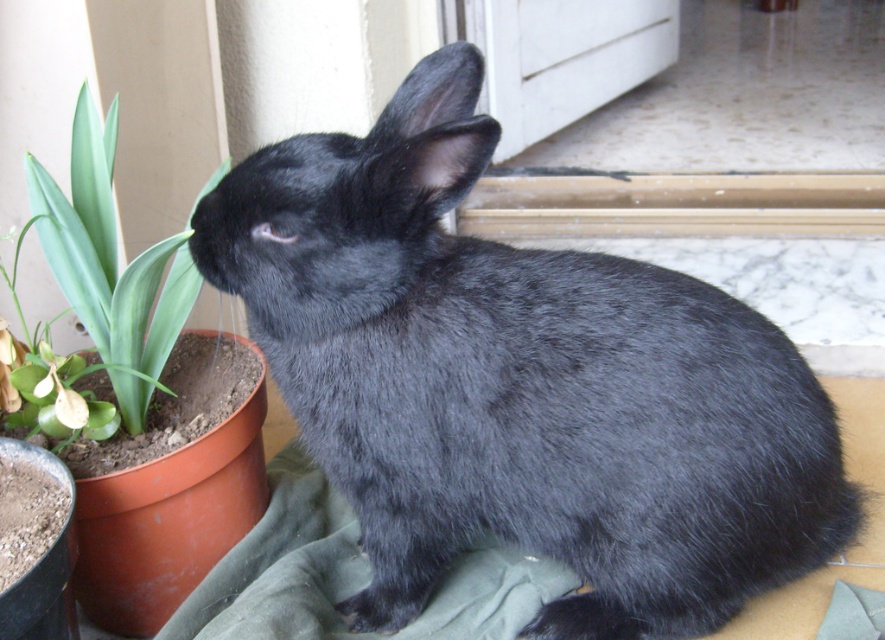
Can you confirm if green leafy plant at lower left is wider than white matte screen door at upper center?

No, green leafy plant at lower left is not wider than white matte screen door at upper center.

Can you confirm if green leafy plant at lower left is bigger than white matte screen door at upper center?

No.

Is point (119, 292) farther from viewer compared to point (531, 118)?

No, (119, 292) is closer to viewer.

In order to click on green leafy plant at lower left in this screenshot , I will do tap(110, 269).

Between black fur rabbit at center and white matte screen door at upper center, which one is positioned lower?

black fur rabbit at center is lower down.

Is black fur rabbit at center taller than white matte screen door at upper center?

Indeed, black fur rabbit at center has a greater height compared to white matte screen door at upper center.

What do you see at coordinates (519, 384) in the screenshot? Image resolution: width=885 pixels, height=640 pixels. I see `black fur rabbit at center` at bounding box center [519, 384].

Where is `black fur rabbit at center`? black fur rabbit at center is located at coordinates (519, 384).

Can you confirm if black fur rabbit at center is positioned to the right of green leafy plant at lower left?

Yes, black fur rabbit at center is to the right of green leafy plant at lower left.

The image size is (885, 640). Describe the element at coordinates (519, 384) in the screenshot. I see `black fur rabbit at center` at that location.

Between point (628, 417) and point (68, 289), which one is positioned behind?

Positioned behind is point (68, 289).

Locate an element on the screen. The width and height of the screenshot is (885, 640). black fur rabbit at center is located at coordinates (519, 384).